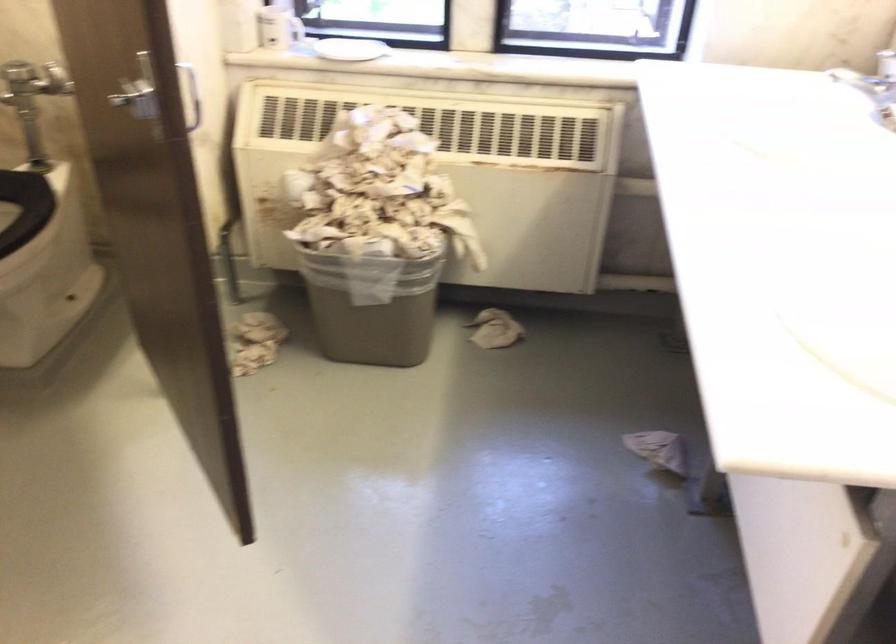
This screenshot has height=644, width=896. Identify the location of faucet handle. (872, 79).